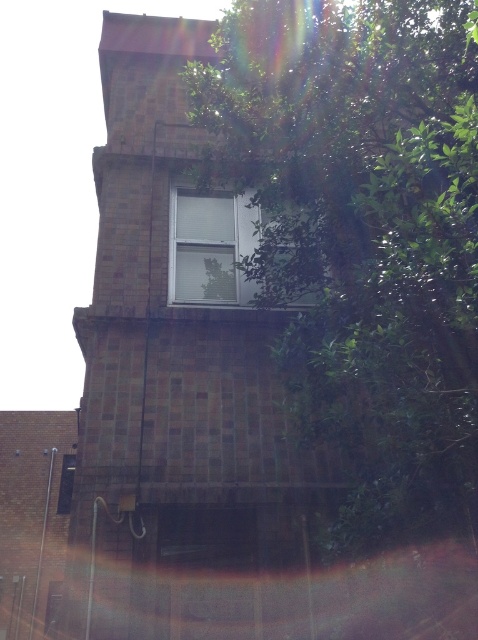
Consider the image. Can you confirm if green leafy tree at upper right is bigger than white matte window at center?

Yes.

Does green leafy tree at upper right have a greater height compared to white matte window at center?

Correct, green leafy tree at upper right is much taller as white matte window at center.

Which is in front, point (397, 445) or point (173, 228)?

Point (397, 445) is more forward.

Where is `green leafy tree at upper right`? green leafy tree at upper right is located at coordinates (362, 234).